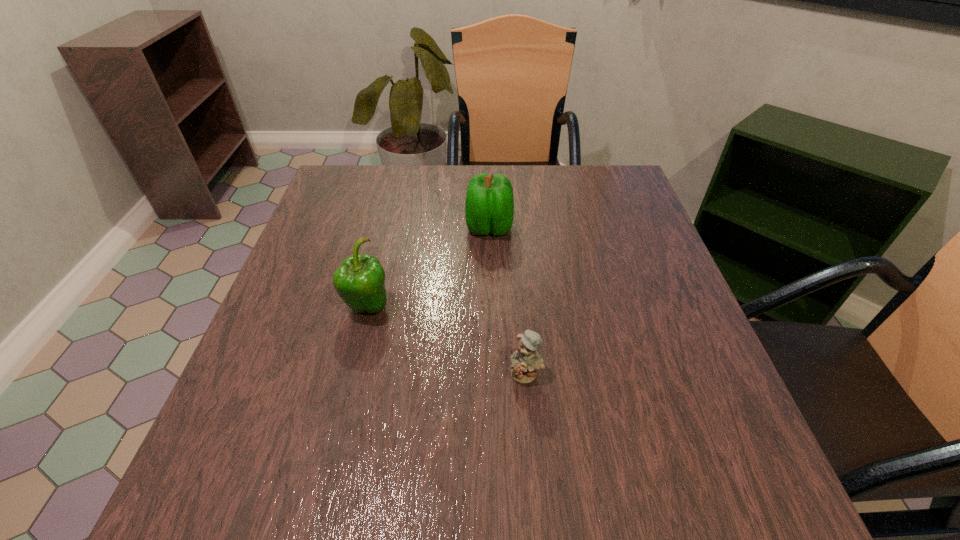
Where is `vacant space that is in between the farther bell pepper and the leftmost object`? vacant space that is in between the farther bell pepper and the leftmost object is located at coordinates (428, 267).

Find the location of a particular element. This screenshot has height=540, width=960. vacant space that is in between the leftmost object and the shortest object is located at coordinates point(446,341).

The image size is (960, 540). I want to click on free point between the second farthest object and the shortest object, so click(446, 341).

At what (x,y) coordinates should I click in order to perform the action: click on empty location between the farthest object and the leftmost object. Please return your answer as a coordinate pair (x, y). The width and height of the screenshot is (960, 540). Looking at the image, I should click on (428, 267).

This screenshot has height=540, width=960. I want to click on vacant area that lies between the leftmost object and the right bell pepper, so click(x=428, y=267).

I want to click on free spot between the teddy bear and the leftmost object, so (x=446, y=341).

Identify the location of free space between the nearer bell pepper and the right bell pepper. Image resolution: width=960 pixels, height=540 pixels. (428, 267).

The height and width of the screenshot is (540, 960). What are the coordinates of `vacant space that's between the shortest object and the nearer bell pepper` in the screenshot? It's located at (446, 341).

Point out which object is positioned as the nearest to the teddy bear. Please provide its 2D coordinates. Your answer should be formatted as a tuple, i.e. [(x, y)], where the tuple contains the x and y coordinates of a point satisfying the conditions above.

[(360, 280)]

Select which object appears as the second closest to the farther bell pepper. Please provide its 2D coordinates. Your answer should be formatted as a tuple, i.e. [(x, y)], where the tuple contains the x and y coordinates of a point satisfying the conditions above.

[(525, 361)]